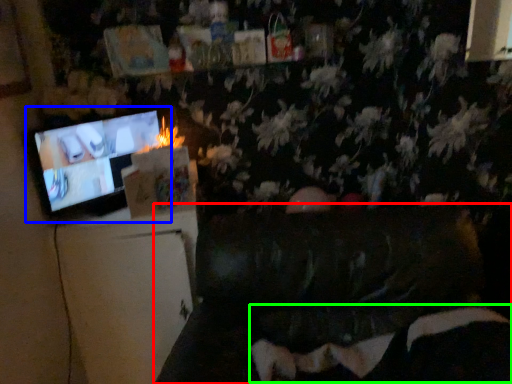
Question: Which object is the closest to the furniture (highlighted by a red box)? Choose among these: television (highlighted by a blue box) or bean bag chair (highlighted by a green box).

Choices:
 (A) television
 (B) bean bag chair

Answer: (B)